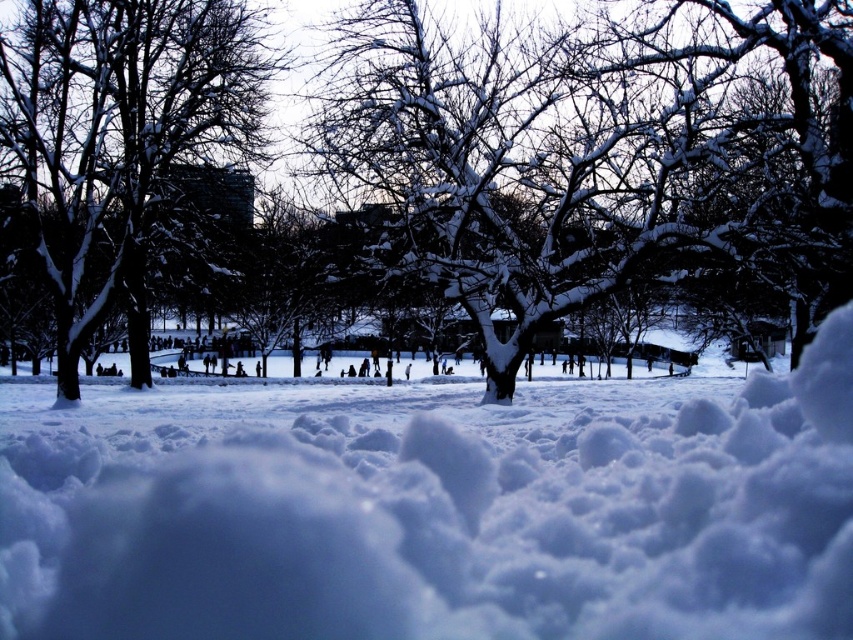
Does white fluffy snow at center have a greater width compared to snow-covered branches at center?

Yes.

How much distance is there between white fluffy snow at center and snow-covered branches at center?

A distance of 4.79 meters exists between white fluffy snow at center and snow-covered branches at center.

Does point (602, 554) come closer to viewer compared to point (547, 109)?

Yes, it is.

You are a GUI agent. You are given a task and a screenshot of the screen. Output one action in this format:
    pyautogui.click(x=<x>, y=<y>)
    Task: Click on the white fluffy snow at center
    The width and height of the screenshot is (853, 640).
    Given the screenshot: What is the action you would take?
    pyautogui.click(x=434, y=508)

Can you confirm if snow-covered branches at center is positioned to the left of snow-covered tree at center?

Incorrect, snow-covered branches at center is not on the left side of snow-covered tree at center.

Locate an element on the screen. snow-covered branches at center is located at coordinates (593, 150).

Is point (552, 193) farther from viewer compared to point (62, 93)?

No.

Find the location of `snow-covered branches at center`. snow-covered branches at center is located at coordinates (593, 150).

Is white fluffy snow at center below snow-covered tree at center?

Yes, white fluffy snow at center is below snow-covered tree at center.

The height and width of the screenshot is (640, 853). Describe the element at coordinates (434, 508) in the screenshot. I see `white fluffy snow at center` at that location.

At what (x,y) coordinates should I click in order to perform the action: click on white fluffy snow at center. Please return your answer as a coordinate pair (x, y). This screenshot has height=640, width=853. Looking at the image, I should click on (434, 508).